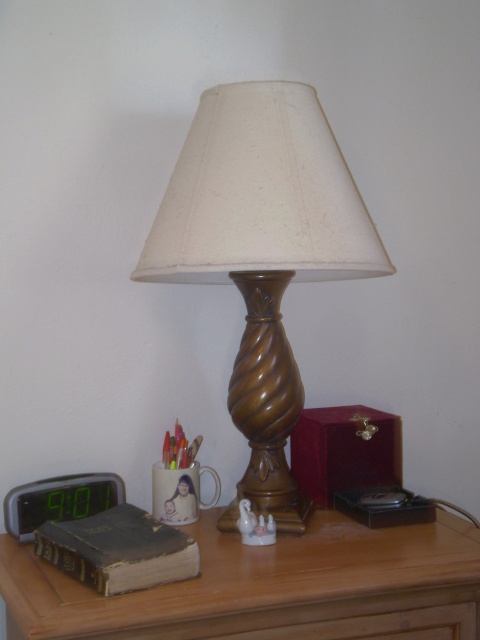
Question: Is brown wooden table at center to the right of green digital display at left from the viewer's perspective?

Choices:
 (A) no
 (B) yes

Answer: (B)

Question: Can you confirm if wooden table lamp at center is positioned above brown wooden table at center?

Choices:
 (A) yes
 (B) no

Answer: (A)

Question: Which of the following is the farthest from the observer?

Choices:
 (A) (107, 515)
 (B) (44, 483)

Answer: (B)

Question: Which point is closer to the camera?

Choices:
 (A) (269, 214)
 (B) (467, 586)
 (C) (49, 525)
 (D) (112, 497)

Answer: (A)

Question: Which of these objects is positioned closest to the green digital display at left?

Choices:
 (A) wooden table lamp at center
 (B) brown leather book at lower left

Answer: (B)

Question: Is wooden table lamp at center to the left of brown wooden table at center from the viewer's perspective?

Choices:
 (A) yes
 (B) no

Answer: (B)